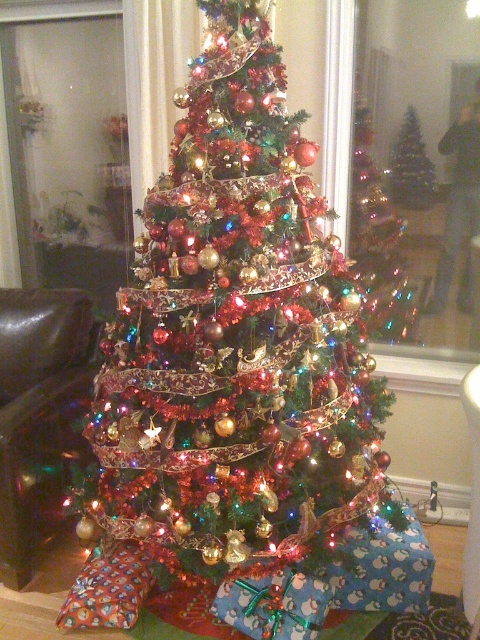
Question: Which of the following is the closest to the observer?

Choices:
 (A) (396, 134)
 (B) (383, 340)

Answer: (A)

Question: Does shiny metallic christmas tree at center lie behind shiny silver christmas tree at center?

Choices:
 (A) yes
 (B) no

Answer: (B)

Question: Which point is farther to the camera?

Choices:
 (A) shiny metallic christmas tree at center
 (B) shiny silver christmas tree at center
 (C) shiny metallic tree at center

Answer: (C)

Question: Based on their relative distances, which object is nearer to the shiny silver christmas tree at center?

Choices:
 (A) shiny metallic christmas tree at center
 (B) shiny metallic tree at center

Answer: (B)

Question: Is the position of shiny metallic tree at center less distant than that of shiny silver christmas tree at center?

Choices:
 (A) no
 (B) yes

Answer: (A)

Question: Does shiny metallic tree at center appear on the right side of shiny silver christmas tree at center?

Choices:
 (A) no
 (B) yes

Answer: (A)